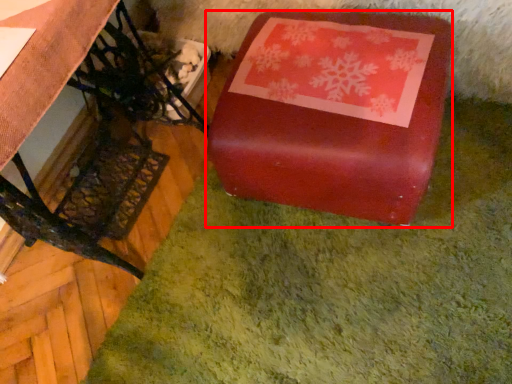
Question: From the image, what is the correct spatial relationship of table (annotated by the red box) in relation to furniture?

Choices:
 (A) right
 (B) left

Answer: (A)